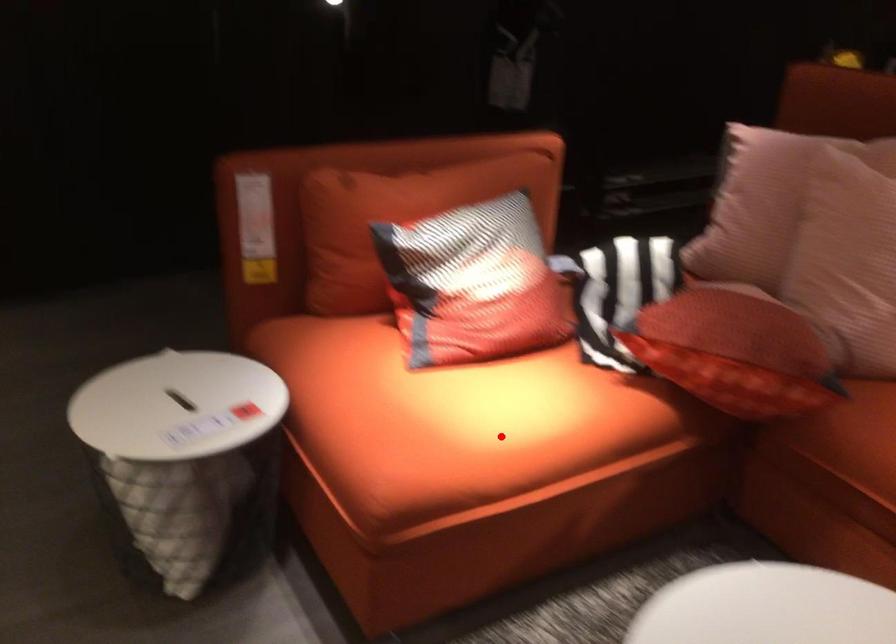
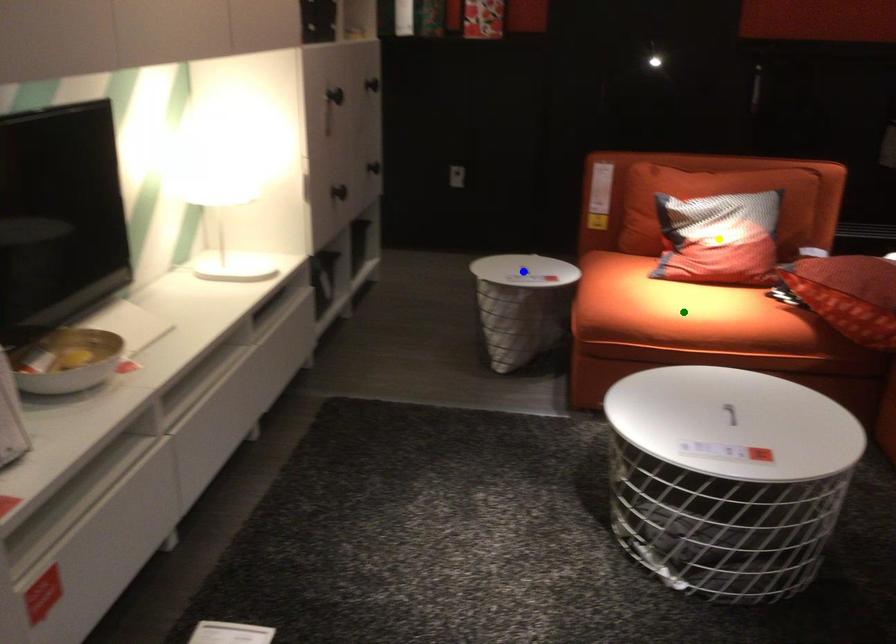
Question: I am providing you with two images of the same scene from different viewpoints. A red point is marked on the first image. You are given multiple points on the second image. Can you choose the point in image 2 that corresponds to the point in image 1?

Choices:
 (A) yellow point
 (B) green point
 (C) blue point

Answer: (B)